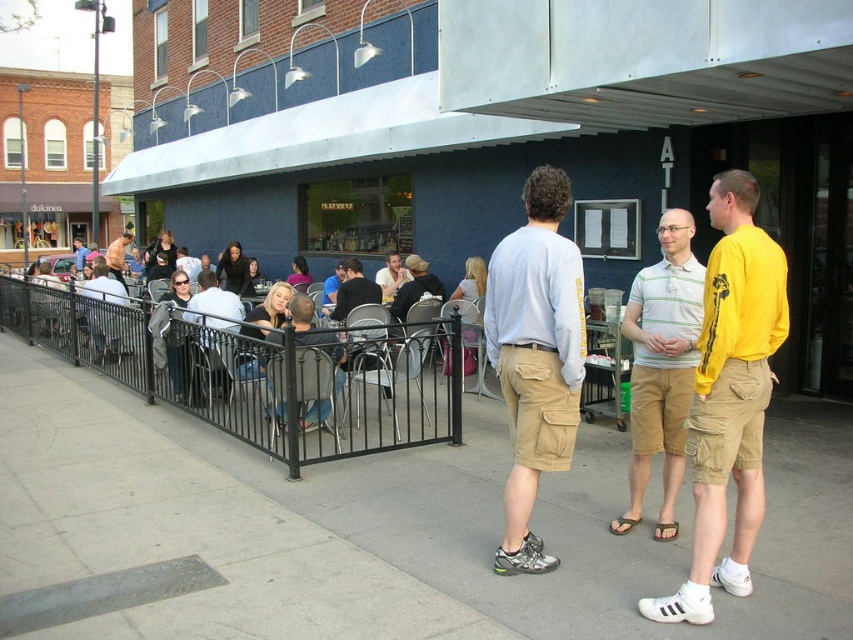
Question: Which point is closer to the camera?

Choices:
 (A) (115, 273)
 (B) (651, 355)
 (C) (322, 332)

Answer: (B)

Question: Is yellow cotton shirt at center in front of matte black shirt at center?

Choices:
 (A) no
 (B) yes

Answer: (B)

Question: Among these points, which one is farthest from the camera?

Choices:
 (A) (555, 170)
 (B) (115, 248)
 (C) (651, 403)

Answer: (B)

Question: Among these points, which one is farthest from the camera?

Choices:
 (A) (350, 264)
 (B) (306, 428)
 (C) (114, 253)

Answer: (C)

Question: Is the position of black metal fence at left less distant than that of matte black shirt at center?

Choices:
 (A) yes
 (B) no

Answer: (A)

Question: Can you confirm if light blue cotton shirt at center is bigger than matte black jacket at left?

Choices:
 (A) yes
 (B) no

Answer: (B)